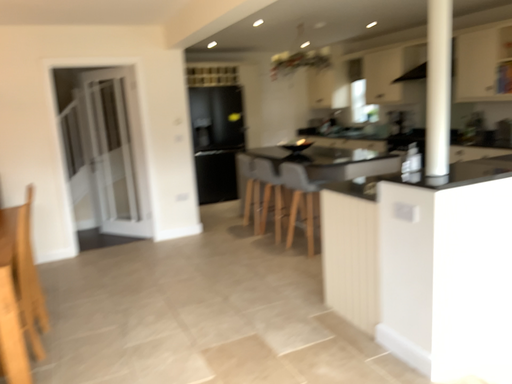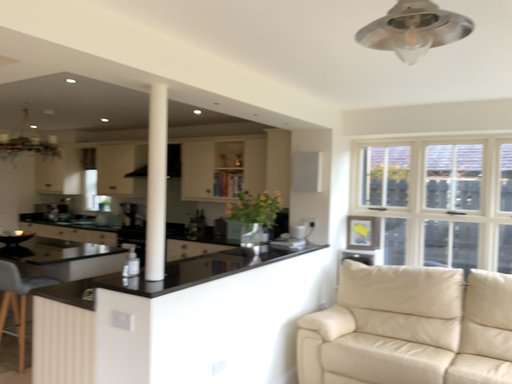
Question: Which way did the camera rotate in the video?

Choices:
 (A) rotated left
 (B) rotated right

Answer: (B)